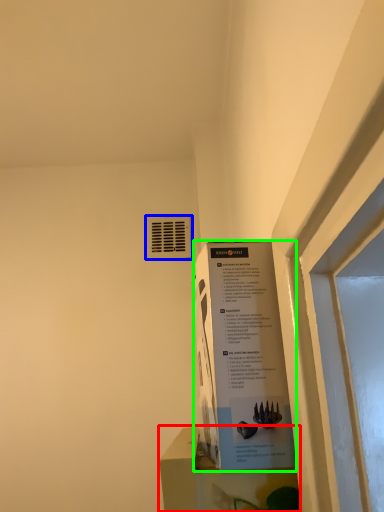
Question: Based on their relative distances, which object is farther from window sill (highlighted by a red box)? Choose from air conditioning (highlighted by a blue box) and poster (highlighted by a green box).

Choices:
 (A) air conditioning
 (B) poster

Answer: (A)